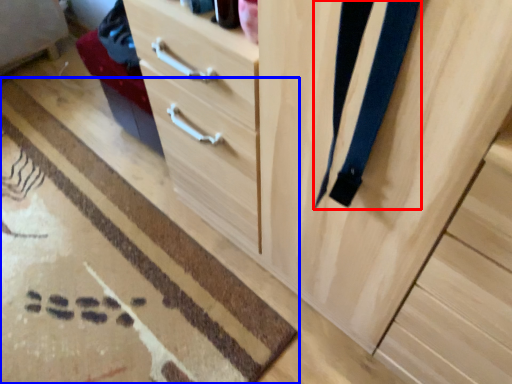
Question: Which of the following is the closest to the observer, suspenders (highlighted by a red box) or doormat (highlighted by a blue box)?

Choices:
 (A) suspenders
 (B) doormat

Answer: (A)